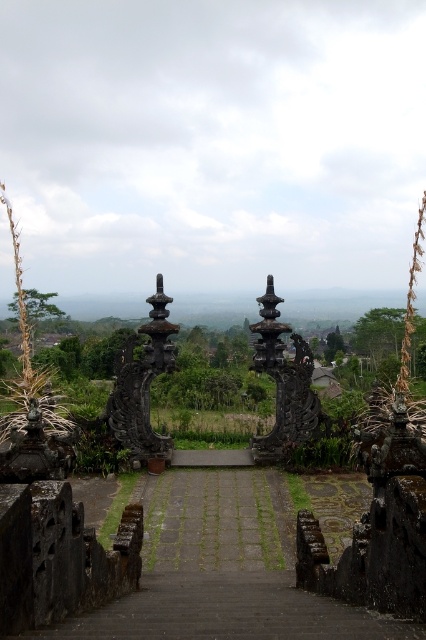
You are standing at the entrance of the Balinese temple complex and want to reach the stairs leading to the main temple area. According to the scene, where should you head towards to find the dark stone stairs at center?

The dark stone stairs at center are located at point (222, 570), so you should head towards that coordinate to find them.

In the scene shown: You are standing at the entrance of the temple complex and want to reach the black stone pillar at center. Which direction should you move relative to the dark stone stairs at center?

The dark stone stairs at center is below the black stone pillar at center, so you should move upward from the dark stone stairs at center to reach the black stone pillar at center.

You are standing at the entrance of the Balinese temple complex and want to take a photo of the dark stone stairs at center and the black stone pillar at center. From your current position, which object is positioned to the left when framing both in the camera?

The dark stone stairs at center is to the left of the black stone pillar at center, so when framing both in the camera, the dark stone stairs at center will be on the left side.